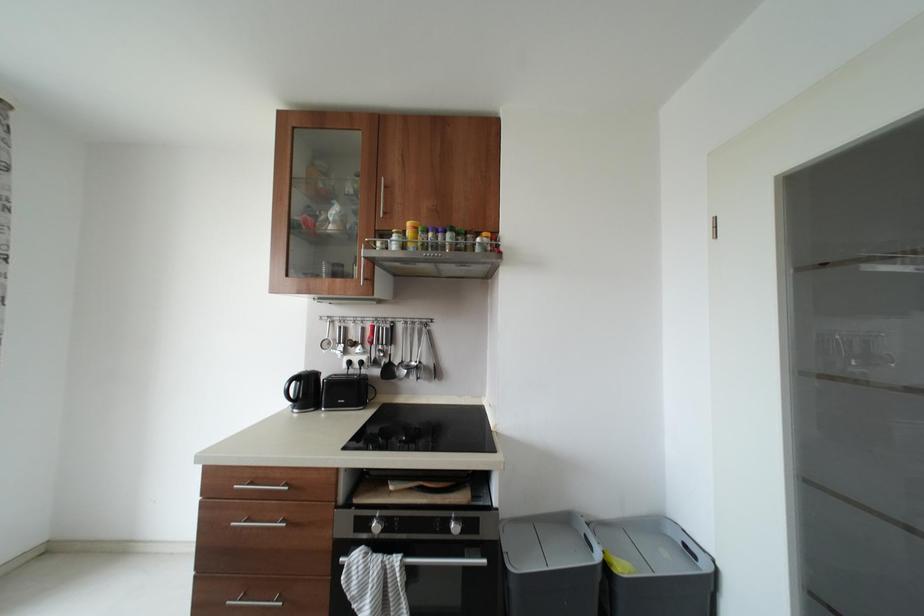
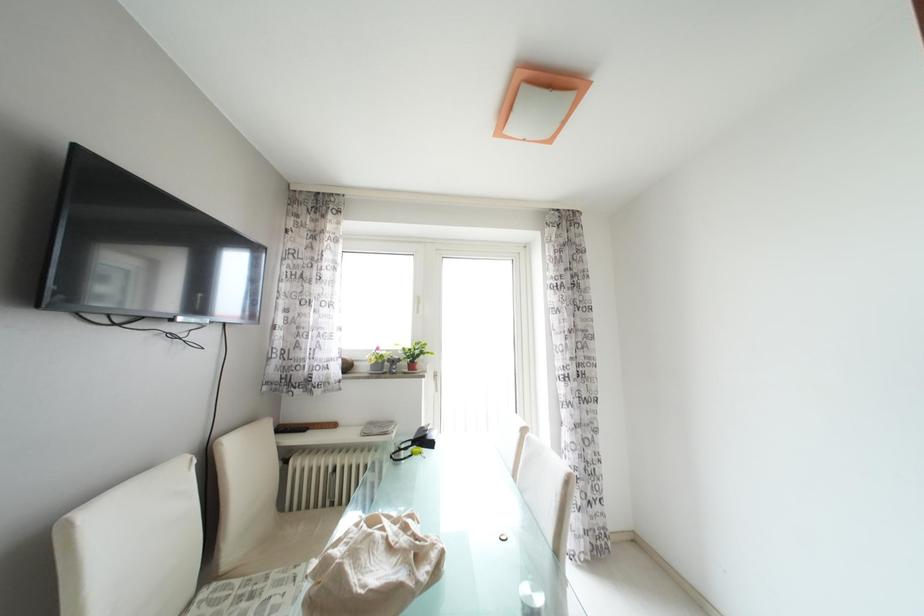
Question: Based on the continuous images, in which direction is the camera rotating? Reply with the corresponding letter.

Choices:
 (A) Left
 (B) Right
 (C) Up
 (D) Down

Answer: (A)